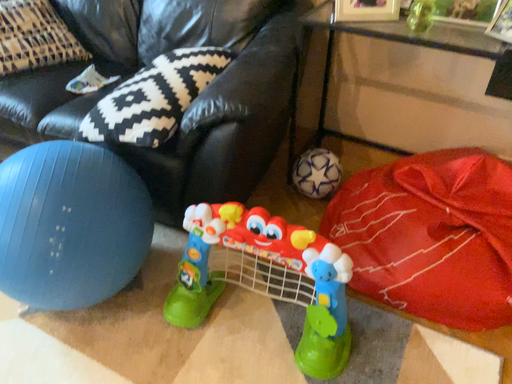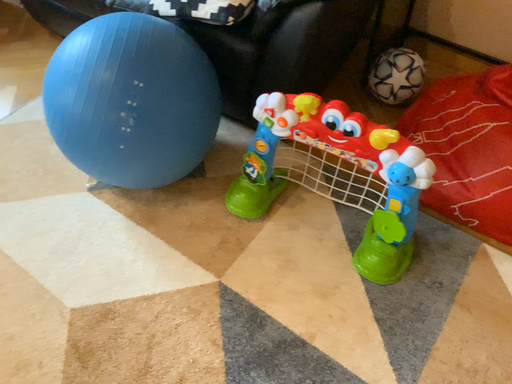
Question: Which way did the camera rotate in the video?

Choices:
 (A) rotated upward
 (B) rotated downward

Answer: (B)